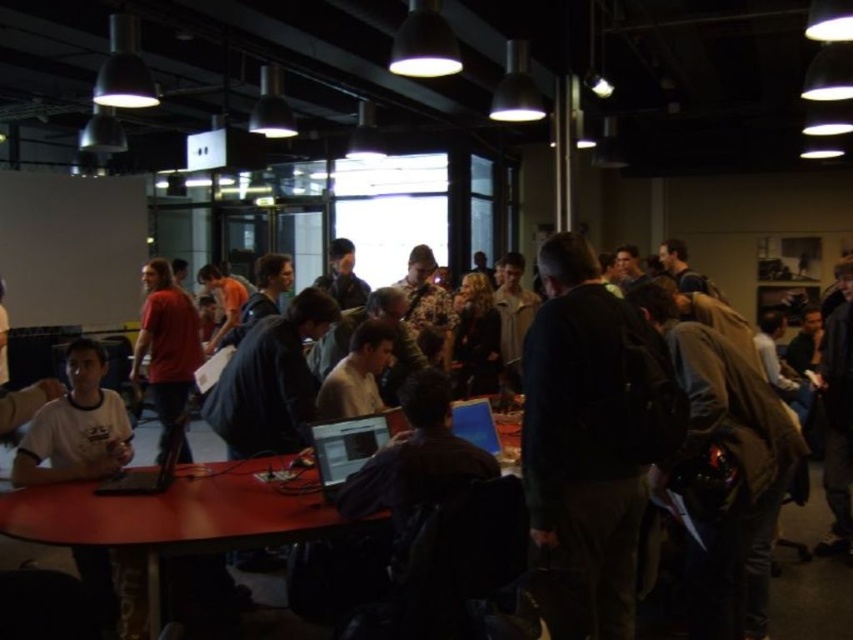
Question: Is dark green jacket at center bigger than dark blue shirt at center?

Choices:
 (A) yes
 (B) no

Answer: (A)

Question: Which point appears farthest from the camera in this image?

Choices:
 (A) (184, 369)
 (B) (112, 488)
 (C) (344, 429)
 (D) (254, 464)

Answer: (A)

Question: Is wooden table at center positioned behind matte black laptop at center?

Choices:
 (A) no
 (B) yes

Answer: (A)

Question: Can you confirm if dark green jacket at center is positioned to the left of matte red shirt at left?

Choices:
 (A) no
 (B) yes

Answer: (A)

Question: Among these points, which one is nearest to the camera?

Choices:
 (A) (635, 371)
 (B) (265, 483)
 (C) (102, 492)

Answer: (A)

Question: Among these points, which one is farthest from the camera?

Choices:
 (A) (553, 436)
 (B) (99, 512)
 (C) (352, 419)

Answer: (C)